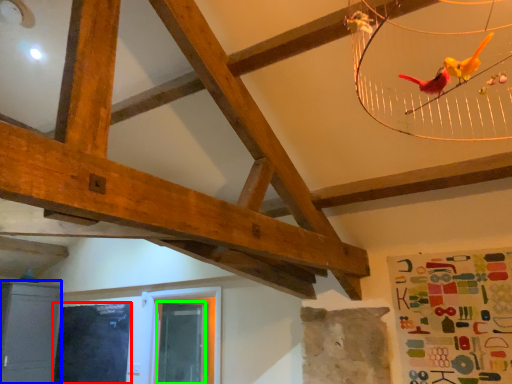
Question: Considering the real-world distances, which object is farthest from window screen (highlighted by a red box)? furniture (highlighted by a blue box) or window screen (highlighted by a green box)?

Choices:
 (A) furniture
 (B) window screen

Answer: (B)